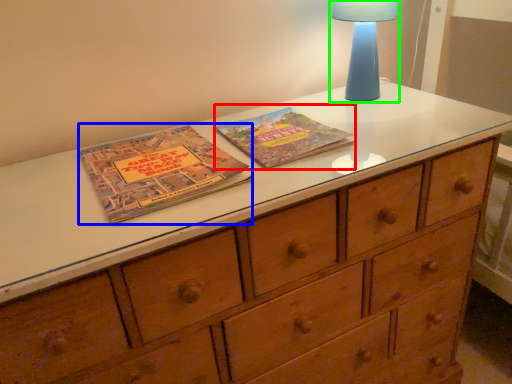
Question: Which object is the farthest from paperback book (highlighted by a red box)? Choose among these: paperback book (highlighted by a blue box) or bedside lamp (highlighted by a green box).

Choices:
 (A) paperback book
 (B) bedside lamp

Answer: (B)